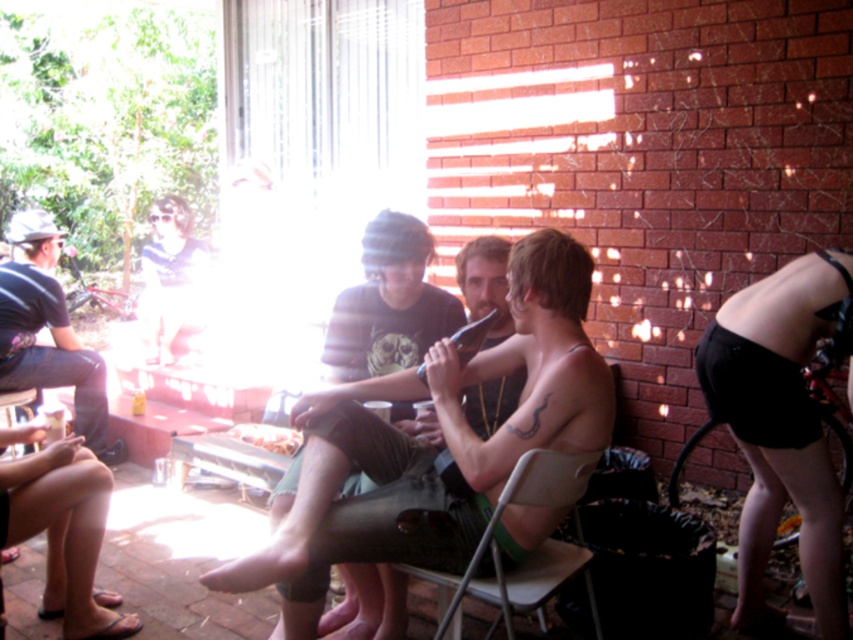
Question: Considering the real-world distances, which object is closest to the dark blue jeans at left?

Choices:
 (A) white plastic chair at lower center
 (B) shiny metallic flute at center
 (C) matte blue shirt at upper left
 (D) black fabric shorts at right

Answer: (C)

Question: Which object is farther from the camera taking this photo?

Choices:
 (A) black fabric shorts at right
 (B) matte blue shirt at upper left
 (C) shiny metallic flute at center
 (D) white plastic chair at lower center

Answer: (B)

Question: Among these objects, which one is nearest to the camera?

Choices:
 (A) black fabric shorts at right
 (B) white plastic chair at lower center
 (C) shiny metallic flute at center

Answer: (C)

Question: Can you confirm if white plastic chair at lower center is positioned to the left of matte blue shirt at upper left?

Choices:
 (A) yes
 (B) no

Answer: (B)

Question: Is shiny metallic flute at center below black fabric shorts at right?

Choices:
 (A) yes
 (B) no

Answer: (A)

Question: Is shiny metallic flute at center below matte blue shirt at upper left?

Choices:
 (A) yes
 (B) no

Answer: (A)